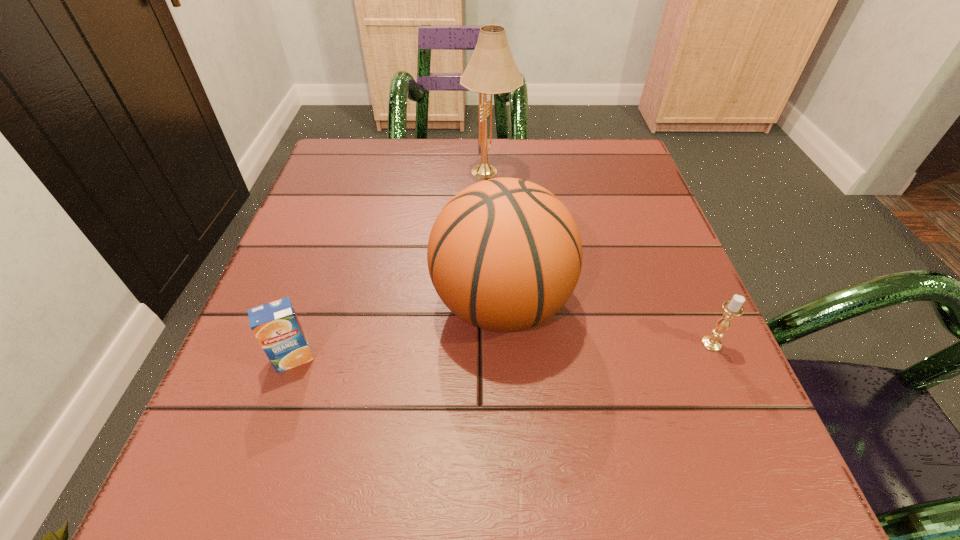
This screenshot has height=540, width=960. What are the coordinates of `vacant space that is in between the basketball and the rightmost object` in the screenshot? It's located at (607, 323).

Locate an element on the screen. empty space that is in between the rightmost object and the tallest object is located at coordinates (601, 258).

Identify the location of unoccupied area between the third shortest object and the candle holder. The height and width of the screenshot is (540, 960). (607, 323).

Find the location of `vacant space in between the leftmost object and the lampshade`. vacant space in between the leftmost object and the lampshade is located at coordinates (392, 265).

Locate an element on the screen. vacant space in between the candle holder and the lampshade is located at coordinates (601, 258).

Where is `the closest object to the rightmost object`? the closest object to the rightmost object is located at coordinates (504, 254).

Locate an element on the screen. Image resolution: width=960 pixels, height=540 pixels. object that is the closest to the third shortest object is located at coordinates coord(276,326).

The width and height of the screenshot is (960, 540). I want to click on vacant area that satisfies the following two spatial constraints: 1. on the back side of the orange_juice; 2. on the left side of the third shortest object, so click(313, 303).

Image resolution: width=960 pixels, height=540 pixels. In order to click on vacant region that satisfies the following two spatial constraints: 1. on the front side of the rightmost object; 2. on the left side of the basketball in this screenshot , I will do `click(503, 344)`.